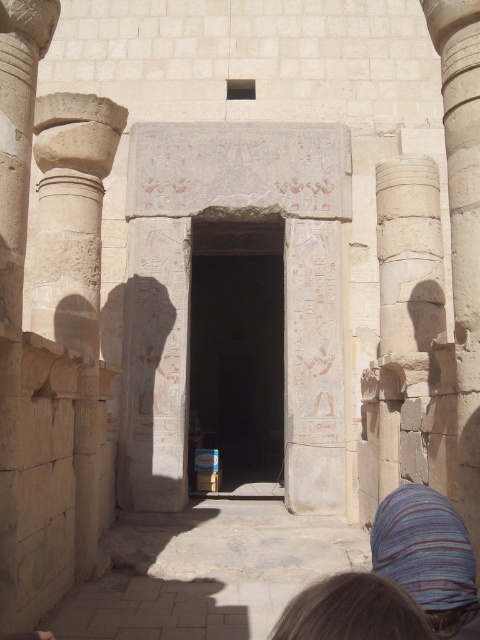
Is smooth stone column at right shorter than striped fabric at lower right?

Incorrect, smooth stone column at right's height does not fall short of striped fabric at lower right's.

Is point (396, 196) more distant than point (468, 572)?

Yes, it is behind point (468, 572).

Locate an element on the screen. The width and height of the screenshot is (480, 640). smooth stone column at right is located at coordinates 407,310.

Which is more to the left, dark stone doorway at center or striped fabric at lower right?

Positioned to the left is dark stone doorway at center.

Who is more forward, (200, 332) or (441, 497)?

Positioned in front is point (441, 497).

Image resolution: width=480 pixels, height=640 pixels. Identify the location of dark stone doorway at center. click(237, 349).

Between dark stone doorway at center and smooth stone column at right, which one has more height?

dark stone doorway at center

Who is positioned more to the left, dark stone doorway at center or smooth stone column at right?

Positioned to the left is dark stone doorway at center.

Locate an element on the screen. dark stone doorway at center is located at coordinates (237, 349).